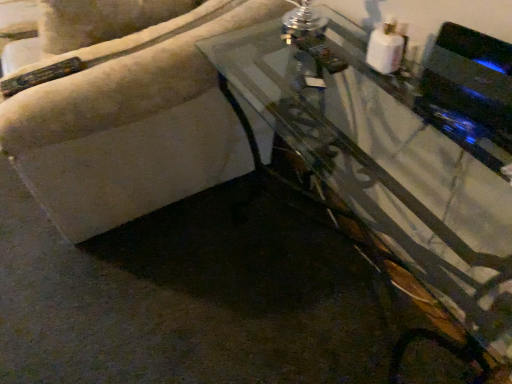
Question: Visually, is transparent glass table at center positioned to the left or to the right of black glossy speaker at upper right?

Choices:
 (A) right
 (B) left

Answer: (B)

Question: From the image's perspective, relative to black glossy speaker at upper right, is transparent glass table at center above or below?

Choices:
 (A) above
 (B) below

Answer: (B)

Question: From a real-world perspective, is transparent glass table at center above or below black glossy speaker at upper right?

Choices:
 (A) below
 (B) above

Answer: (A)

Question: Considering the positions of point (502, 112) and point (273, 61), is point (502, 112) closer or farther from the camera than point (273, 61)?

Choices:
 (A) farther
 (B) closer

Answer: (B)

Question: Visually, is black glossy speaker at upper right positioned to the left or to the right of transparent glass table at center?

Choices:
 (A) right
 (B) left

Answer: (A)

Question: Is black glossy speaker at upper right situated inside transparent glass table at center or outside?

Choices:
 (A) inside
 (B) outside

Answer: (B)

Question: Is black glossy speaker at upper right wider or thinner than transparent glass table at center?

Choices:
 (A) wide
 (B) thin

Answer: (B)